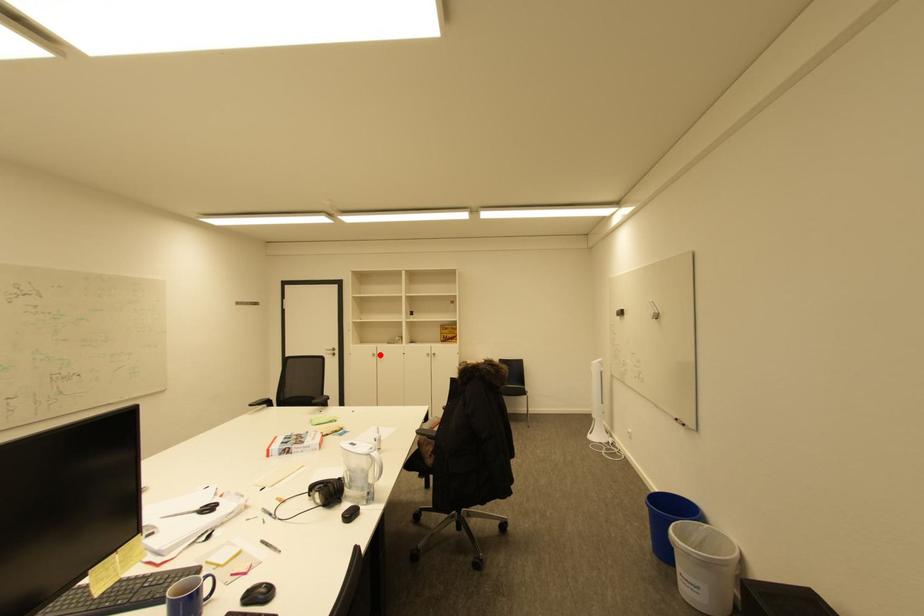
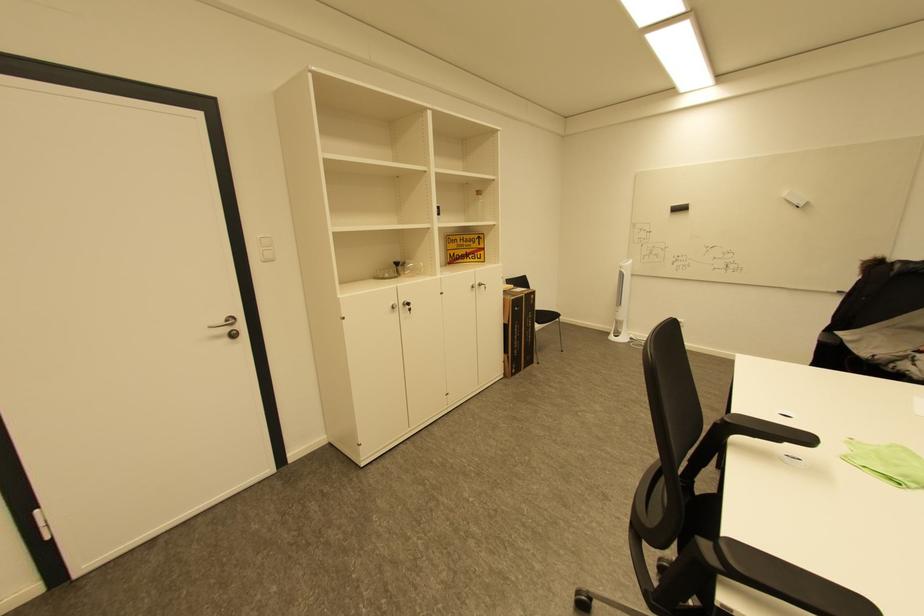
Question: A red point is marked in image1. In image2, is the corresponding 3D point closer to the camera or farther? Reply with the corresponding letter.

Choices:
 (A) The corresponding 3D point is closer.
 (B) The corresponding 3D point is farther.

Answer: (A)